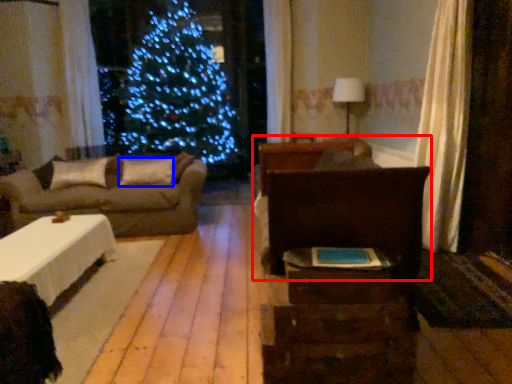
Question: Which object appears farthest to the camera in this image, bed (highlighted by a red box) or pillow (highlighted by a blue box)?

Choices:
 (A) bed
 (B) pillow

Answer: (B)